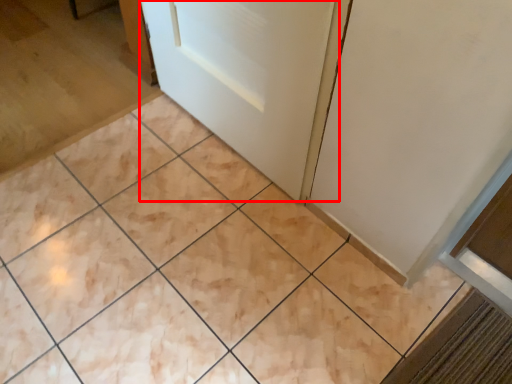
Question: From the image's perspective, what is the correct spatial relationship of door (annotated by the red box) in relation to ceramic tile?

Choices:
 (A) below
 (B) above

Answer: (B)